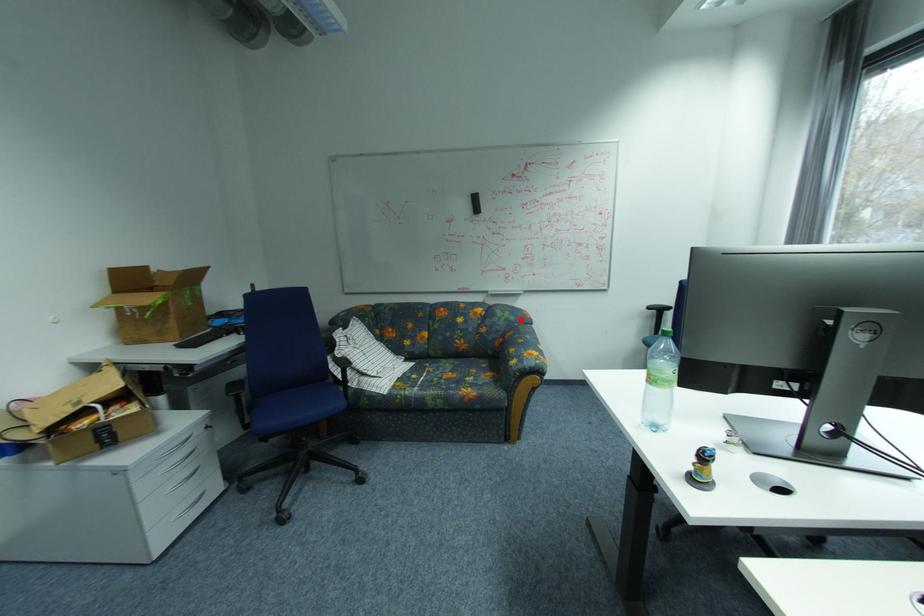
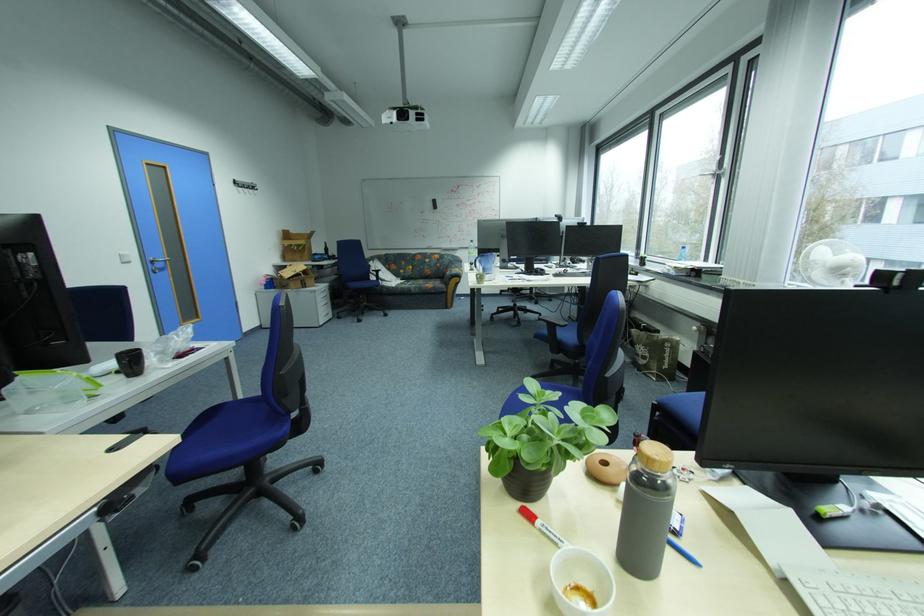
The point at the highlighted location is marked in the first image. Where is the corresponding point in the second image?

(460, 261)